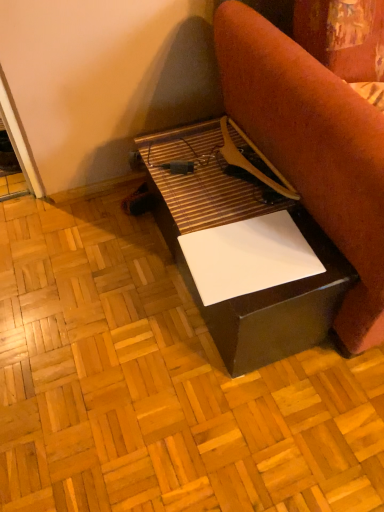
The width and height of the screenshot is (384, 512). I want to click on vacant point to the left of matte black table at center, so click(89, 291).